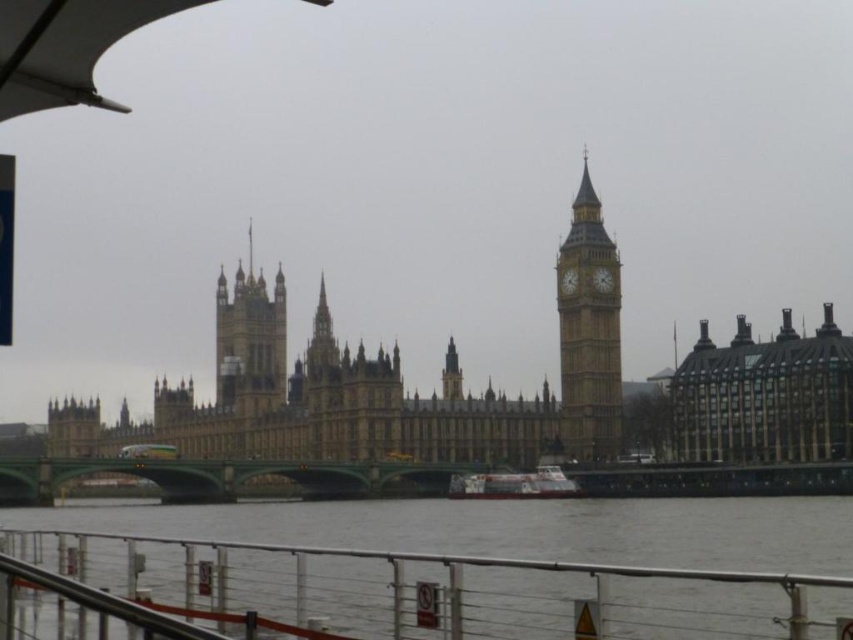
Which is more to the right, dark brown stone building at right or white plastic boat at center?

From the viewer's perspective, dark brown stone building at right appears more on the right side.

Can you confirm if dark brown stone building at right is positioned to the right of white plastic boat at center?

Indeed, dark brown stone building at right is positioned on the right side of white plastic boat at center.

Between point (793, 403) and point (552, 472), which one is positioned behind?

The point (552, 472) is more distant.

At what (x,y) coordinates should I click in order to perform the action: click on dark brown stone building at right. Please return your answer as a coordinate pair (x, y). Looking at the image, I should click on (764, 396).

From the picture: Is dark brown stone building at right further to the viewer compared to green concrete bridge at lower center?

That is False.

Is dark brown stone building at right below green concrete bridge at lower center?

No, dark brown stone building at right is not below green concrete bridge at lower center.

Locate an element on the screen. The height and width of the screenshot is (640, 853). dark brown stone building at right is located at coordinates (764, 396).

Find the location of a particular element. dark brown stone building at right is located at coordinates (764, 396).

Is metallic silver rail at lower center positioned before green concrete bridge at lower center?

Yes, it is in front of green concrete bridge at lower center.

This screenshot has height=640, width=853. Identify the location of metallic silver rail at lower center. [440, 592].

You are a GUI agent. You are given a task and a screenshot of the screen. Output one action in this format:
    pyautogui.click(x=<x>, y=<y>)
    Task: Click on the metallic silver rail at lower center
    This screenshot has width=853, height=640.
    Given the screenshot: What is the action you would take?
    pyautogui.click(x=440, y=592)